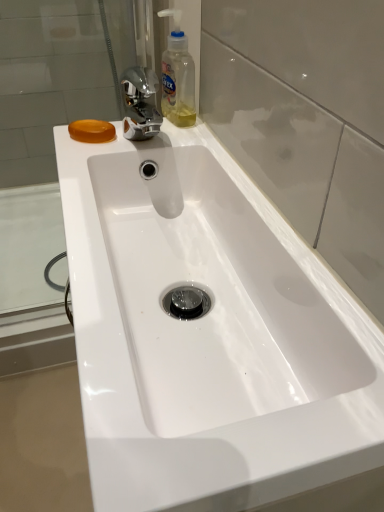
Find the location of a particular element. orange translucent soap at upper left is located at coordinates coord(92,131).

This screenshot has width=384, height=512. What do you see at coordinates (306, 119) in the screenshot? I see `transparent glass door at center` at bounding box center [306, 119].

You are a GUI agent. You are given a task and a screenshot of the screen. Output one action in this format:
    pyautogui.click(x=<x>, y=<y>)
    Task: Click on the orange translucent soap at upper left
    This screenshot has height=512, width=384.
    Given the screenshot: What is the action you would take?
    pyautogui.click(x=92, y=131)

How many degrees apart are the facing directions of translucent plastic bottle at upper center and orange translucent soap at upper left?

The angle between the facing direction of translucent plastic bottle at upper center and the facing direction of orange translucent soap at upper left is 0.218 degrees.

Is translucent plastic bottle at upper center not near orange translucent soap at upper left?

translucent plastic bottle at upper center is near orange translucent soap at upper left, not far away.

Is translucent plastic bottle at upper center oriented away from orange translucent soap at upper left?

No, translucent plastic bottle at upper center's orientation is not away from orange translucent soap at upper left.

Considering the relative sizes of translucent plastic bottle at upper center and orange translucent soap at upper left in the image provided, is translucent plastic bottle at upper center shorter than orange translucent soap at upper left?

No.

Between orange translucent soap at upper left and translucent plastic bottle at upper center, which one has smaller width?

translucent plastic bottle at upper center.

From the image's perspective, relative to translucent plastic bottle at upper center, is orange translucent soap at upper left above or below?

orange translucent soap at upper left is below translucent plastic bottle at upper center.

Is translucent plastic bottle at upper center at the back of orange translucent soap at upper left?

orange translucent soap at upper left does not have its back to translucent plastic bottle at upper center.

Considering the relative positions of orange translucent soap at upper left and translucent plastic bottle at upper center in the image provided, is orange translucent soap at upper left in front of translucent plastic bottle at upper center?

No, orange translucent soap at upper left is further to the viewer.

Based on the photo, is transparent glass door at center outside of translucent plastic bottle at upper center?

Yes, transparent glass door at center is not within translucent plastic bottle at upper center.

Could you tell me if transparent glass door at center is facing translucent plastic bottle at upper center?

Yes, transparent glass door at center is aimed at translucent plastic bottle at upper center.

Based on the photo, considering the positions of objects transparent glass door at center and translucent plastic bottle at upper center in the image provided, who is more to the right, transparent glass door at center or translucent plastic bottle at upper center?

transparent glass door at center.

From the image's perspective, is transparent glass door at center positioned above or below translucent plastic bottle at upper center?

Result: Based on their image positions, transparent glass door at center is located beneath translucent plastic bottle at upper center.

Is point (175, 46) positioned after point (358, 114)?

That is True.

Between translucent plastic bottle at upper center and transparent glass door at center, which one has more height?

With more height is transparent glass door at center.

Is translucent plastic bottle at upper center to the left of transparent glass door at center from the viewer's perspective?

Correct, you'll find translucent plastic bottle at upper center to the left of transparent glass door at center.

Is translucent plastic bottle at upper center looking in the opposite direction of transparent glass door at center?

No, translucent plastic bottle at upper center is not facing away from transparent glass door at center.

Is point (362, 294) positioned before point (111, 126)?

Yes, point (362, 294) is closer to viewer.

Can you tell me how much transparent glass door at center and orange translucent soap at upper left differ in facing direction?

transparent glass door at center and orange translucent soap at upper left are facing 2.75 degrees away from each other.

Does transparent glass door at center touch orange translucent soap at upper left?

No, transparent glass door at center is not in contact with orange translucent soap at upper left.

From the image's perspective, is transparent glass door at center on top of orange translucent soap at upper left?

Actually, transparent glass door at center appears below orange translucent soap at upper left in the image.

Considering the sizes of objects orange translucent soap at upper left and transparent glass door at center in the image provided, who is taller, orange translucent soap at upper left or transparent glass door at center?

transparent glass door at center.

From a real-world perspective, who is located higher, orange translucent soap at upper left or transparent glass door at center?

transparent glass door at center is physically above.

Is orange translucent soap at upper left outside of transparent glass door at center?

Indeed, orange translucent soap at upper left is completely outside transparent glass door at center.

Is orange translucent soap at upper left oriented away from transparent glass door at center?

Yes, orange translucent soap at upper left's orientation is away from transparent glass door at center.

The width and height of the screenshot is (384, 512). I want to click on cleaning product above the orange translucent soap at upper left (from the image's perspective), so click(178, 74).

The image size is (384, 512). What are the coordinates of `soap that is behind the translucent plastic bottle at upper center` in the screenshot? It's located at (92, 131).

Based on their spatial positions, is translucent plastic bottle at upper center or transparent glass door at center closer to orange translucent soap at upper left?

Based on the image, translucent plastic bottle at upper center appears to be nearer to orange translucent soap at upper left.

Looking at the image, which one is located closer to transparent glass door at center, translucent plastic bottle at upper center or orange translucent soap at upper left?

Among the two, translucent plastic bottle at upper center is located nearer to transparent glass door at center.

When comparing their distances from transparent glass door at center, does orange translucent soap at upper left or translucent plastic bottle at upper center seem further?

The object further to transparent glass door at center is orange translucent soap at upper left.

Estimate the real-world distances between objects in this image. Which object is further from orange translucent soap at upper left, transparent glass door at center or translucent plastic bottle at upper center?

transparent glass door at center is further to orange translucent soap at upper left.

When comparing their distances from translucent plastic bottle at upper center, does transparent glass door at center or orange translucent soap at upper left seem closer?

orange translucent soap at upper left lies closer to translucent plastic bottle at upper center than the other object.

From the image, which object appears to be farther from translucent plastic bottle at upper center, orange translucent soap at upper left or transparent glass door at center?

transparent glass door at center is positioned further to the anchor translucent plastic bottle at upper center.

Where is `cleaning product between transparent glass door at center and orange translucent soap at upper left along the z-axis`? The width and height of the screenshot is (384, 512). cleaning product between transparent glass door at center and orange translucent soap at upper left along the z-axis is located at coordinates (178, 74).